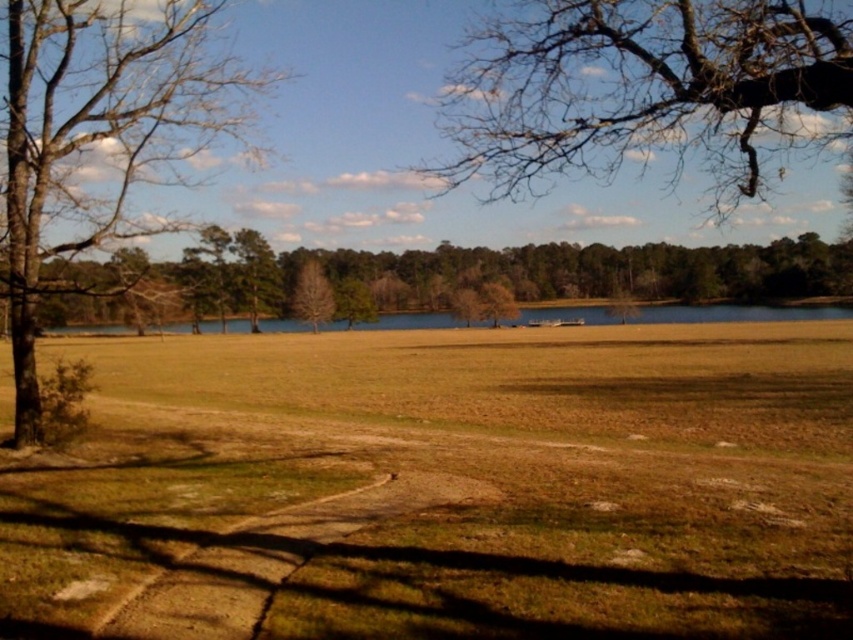
Question: Can you confirm if brown dry grass at center is thinner than bare branches at upper center?

Choices:
 (A) yes
 (B) no

Answer: (B)

Question: Estimate the real-world distances between objects in this image. Which object is farther from the brown leafless tree at center?

Choices:
 (A) brown matte tree at center
 (B) bare branches at upper center
 (C) brown rough bark tree at left
 (D) brown dry grass at center

Answer: (D)

Question: Is brown dry grass at center positioned behind brown rough bark tree at left?

Choices:
 (A) no
 (B) yes

Answer: (A)

Question: Which object is the closest to the brown rough bark tree at left?

Choices:
 (A) bare branches at upper center
 (B) brown dry grass at center

Answer: (B)

Question: Which object is the farthest from the brown rough bark tree at left?

Choices:
 (A) brown leafless tree at center
 (B) brown matte tree at center
 (C) brown dry grass at center

Answer: (B)

Question: Is bare branches at upper center wider than brown rough bark tree at left?

Choices:
 (A) no
 (B) yes

Answer: (B)